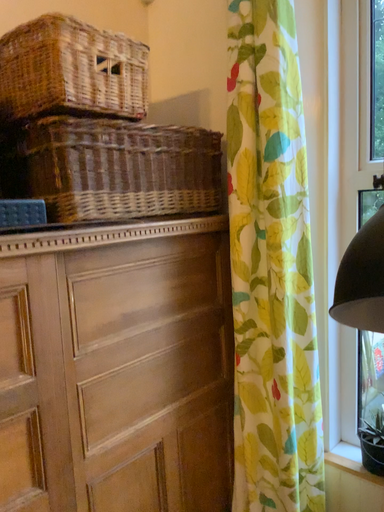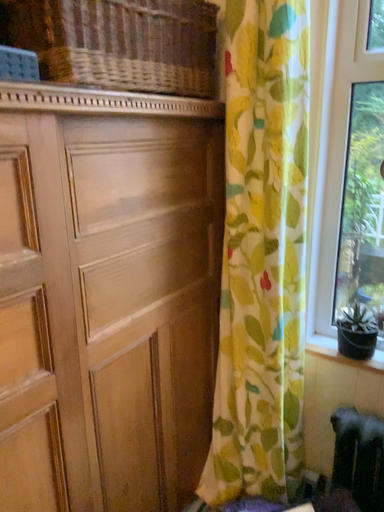
Question: How did the camera likely rotate when shooting the video?

Choices:
 (A) rotated downward
 (B) rotated upward

Answer: (A)